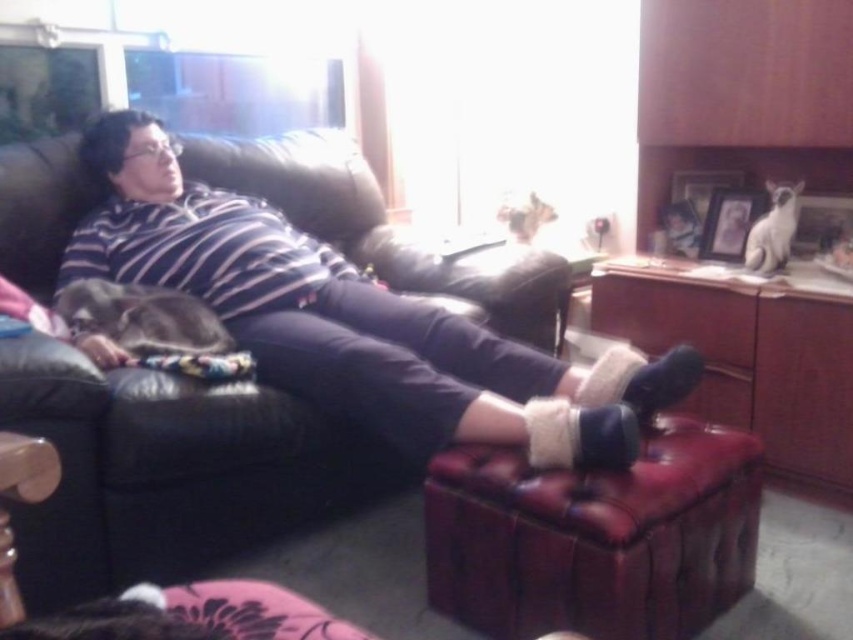
You are a guest in this living room and want to sit down. You see the black leather couch at upper left and the leather ottoman at lower center. Which one is more to the left?

The black leather couch at upper left is more to the left because it is positioned on the left side of the leather ottoman at lower center.

You are standing in the living room and want to place a small plant between the two points marked as point (376, 477) and point (517, 464). Based on their positions, which point should the plant be closer to?

The plant should be closer to point (517, 464) because point (376, 477) is behind it.